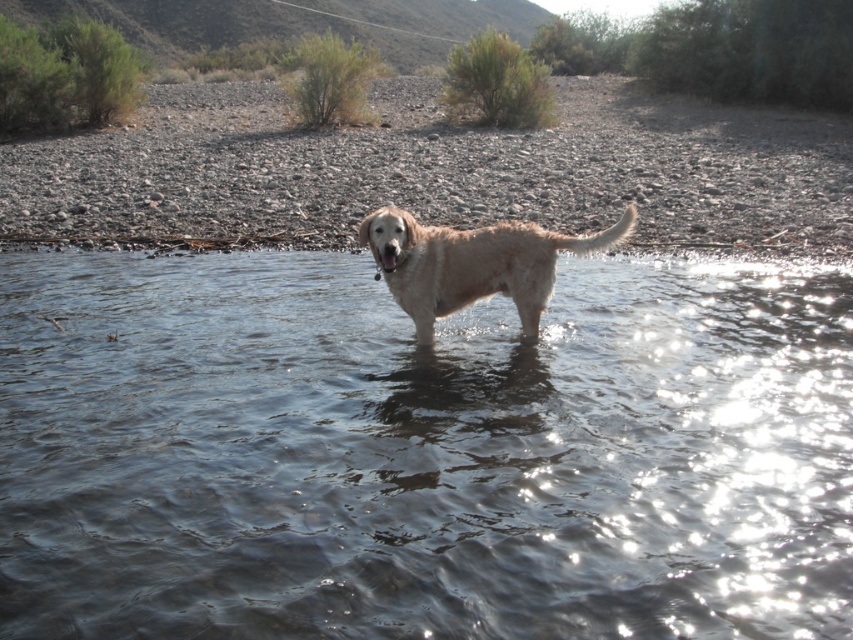
Can you confirm if clear water at center is positioned to the right of fuzzy golden dog at center?

Correct, you'll find clear water at center to the right of fuzzy golden dog at center.

Between clear water at center and fuzzy golden dog at center, which one is positioned lower?

Positioned lower is clear water at center.

This screenshot has height=640, width=853. Identify the location of clear water at center. (422, 452).

Image resolution: width=853 pixels, height=640 pixels. What are the coordinates of `clear water at center` in the screenshot? It's located at (422, 452).